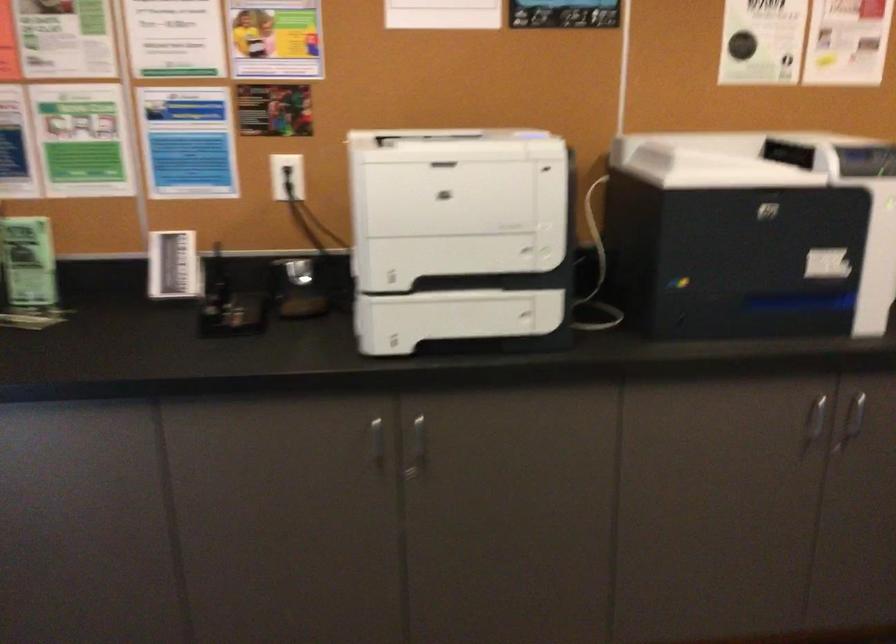
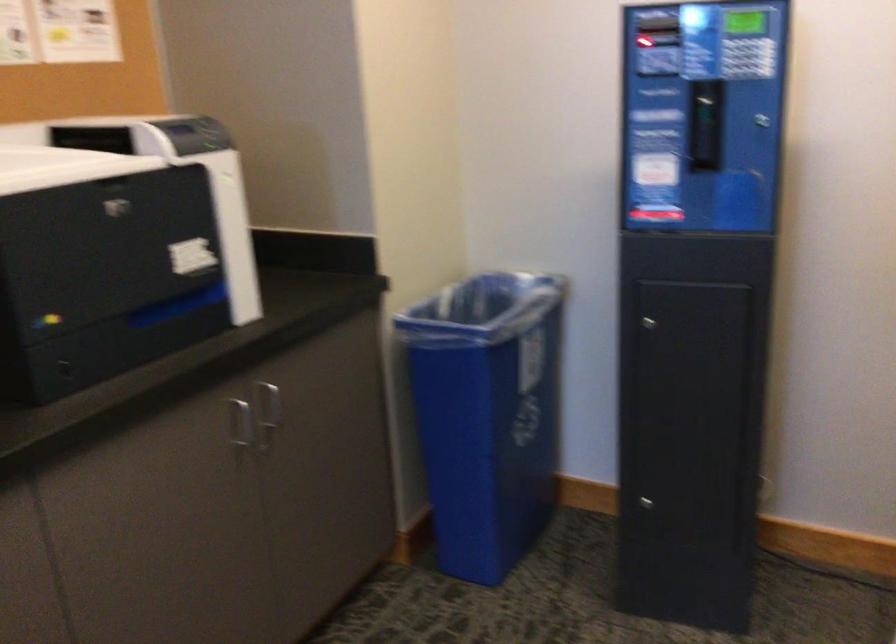
In the second image, find the point that corresponds to (x=814, y=420) in the first image.

(239, 424)